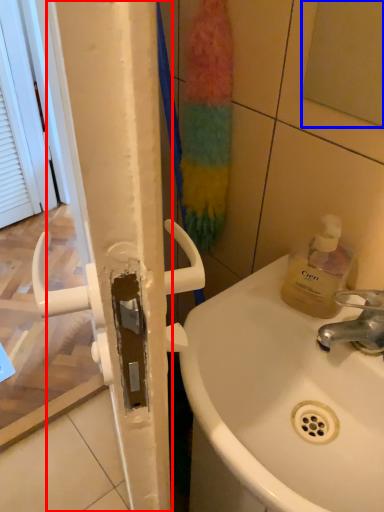
Question: Which point is closer to the camera, shower door (highlighted by a red box) or mirror (highlighted by a blue box)?

Choices:
 (A) shower door
 (B) mirror

Answer: (B)